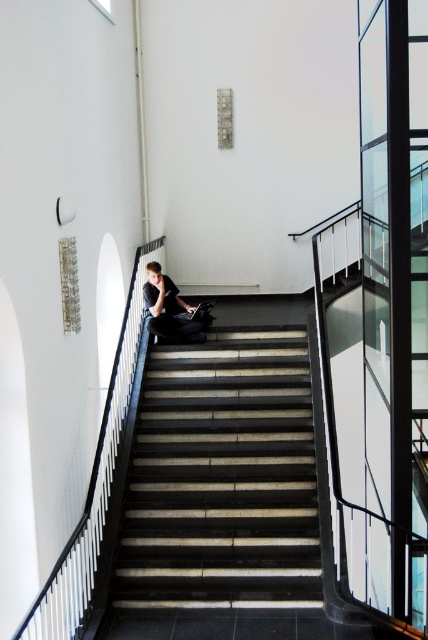
You are carrying a heavy box and need to place it on either the dark gray concrete stairs at center or the dark gray fabric jacket at center. Based on their positions, which one is higher up and thus more accessible without bending down?

The dark gray fabric jacket at center is higher up than the dark gray concrete stairs at center, so it would be more accessible without bending down.

You are moving a large painting that is 1.5 meters wide. You need to carry it through the dark gray concrete stairs at center while avoiding the dark gray fabric jacket at center. Can you pass through safely?

The dark gray concrete stairs at center are wider than the dark gray fabric jacket at center, so yes, you can safely pass through with the large painting that is 1.5 meters wide by navigating around the narrower dark gray fabric jacket at center.